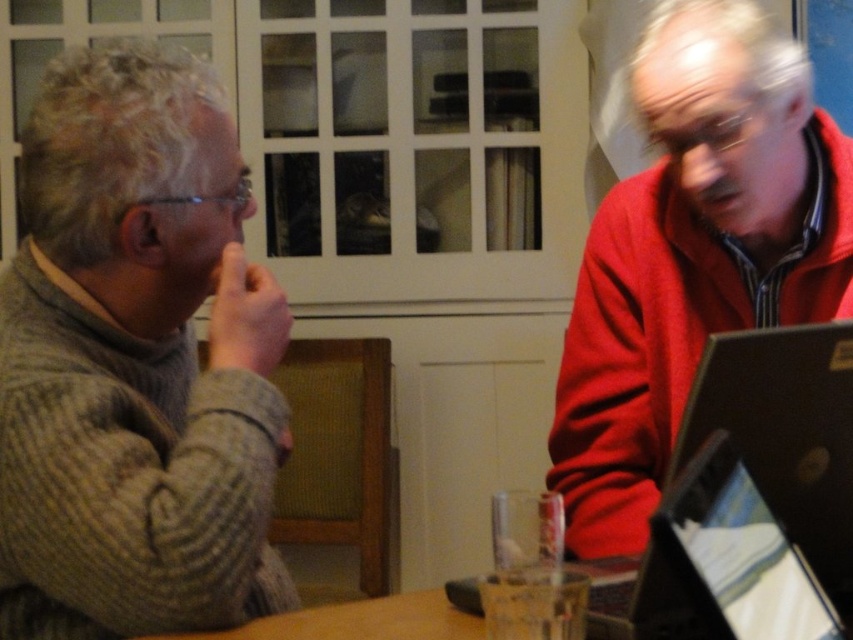
Question: Does knitted gray sweater at left have a greater width compared to red fleece jacket at right?

Choices:
 (A) yes
 (B) no

Answer: (B)

Question: Does knitted gray sweater at left have a greater width compared to red fleece jacket at right?

Choices:
 (A) no
 (B) yes

Answer: (A)

Question: Which point is closer to the camera?

Choices:
 (A) (234, 332)
 (B) (653, 205)

Answer: (A)

Question: Which object is closer to the camera taking this photo?

Choices:
 (A) knitted gray sweater at left
 (B) red fleece jacket at right

Answer: (A)

Question: Can you confirm if knitted gray sweater at left is smaller than red fleece jacket at right?

Choices:
 (A) yes
 (B) no

Answer: (B)